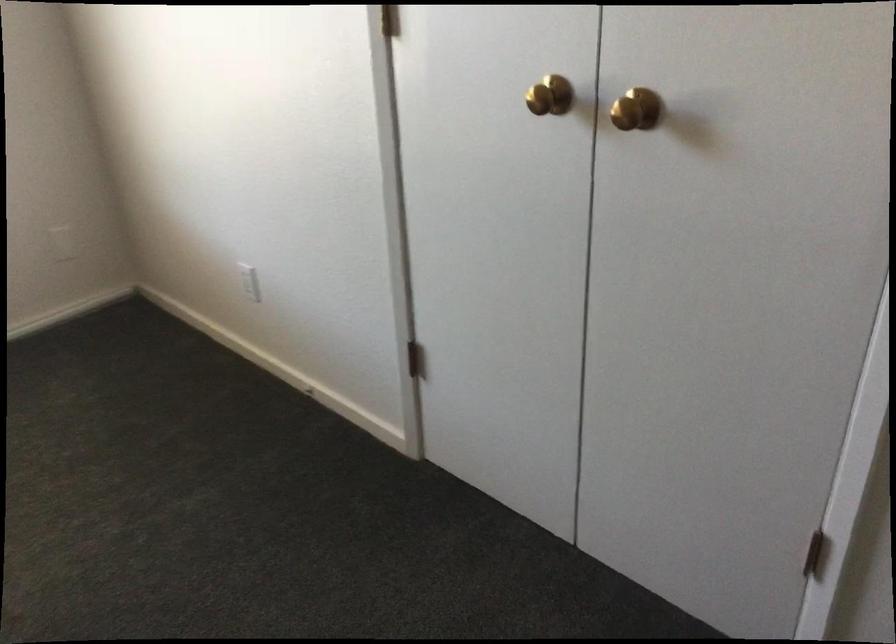
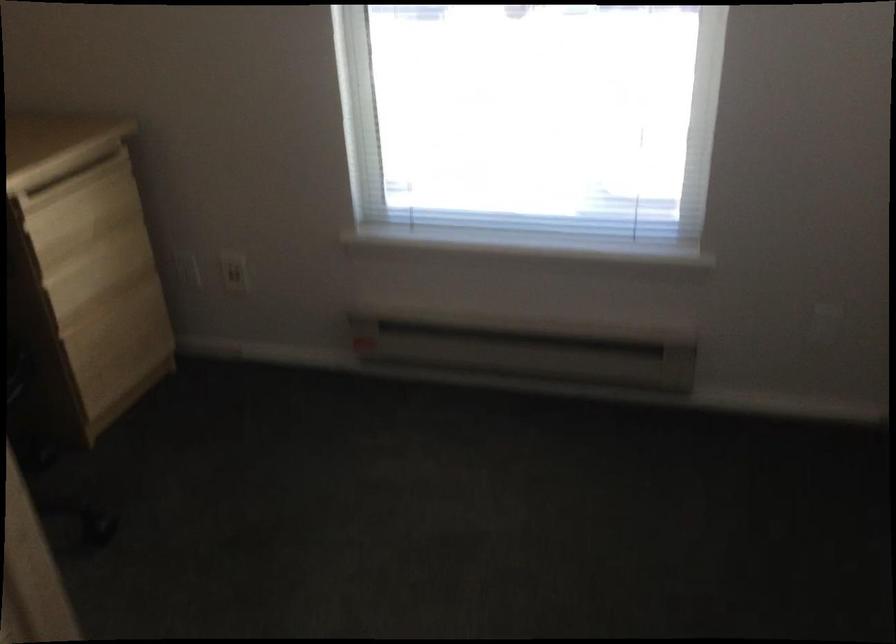
Based on the continuous images, in which direction is the camera rotating?

The camera rotated toward left-down.